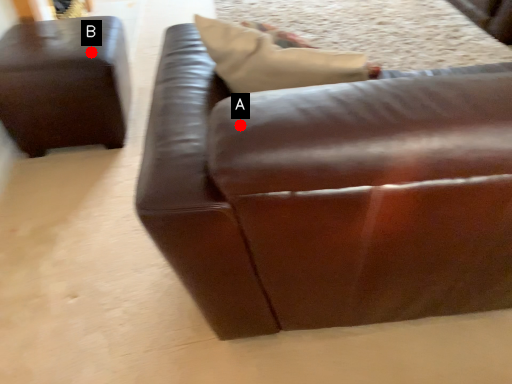
Question: Two points are circled on the image, labeled by A and B beside each circle. Which of the following is the closest to the observer?

Choices:
 (A) A is closer
 (B) B is closer

Answer: (A)